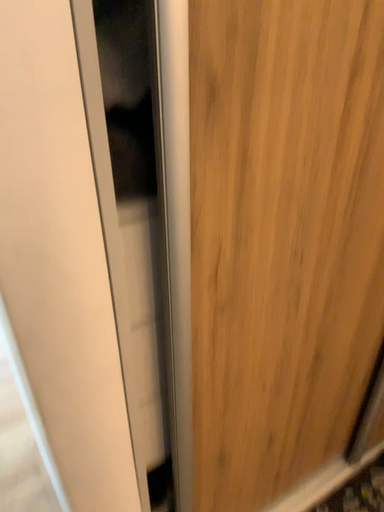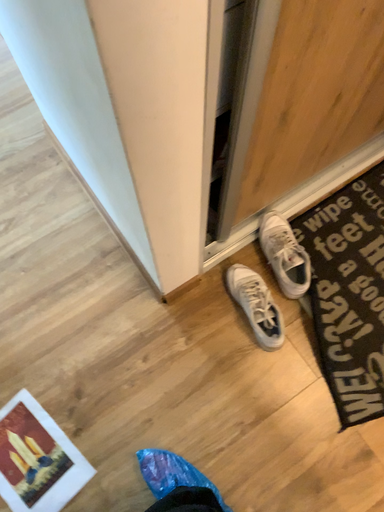
Question: How did the camera likely rotate when shooting the video?

Choices:
 (A) rotated downward
 (B) rotated upward

Answer: (A)